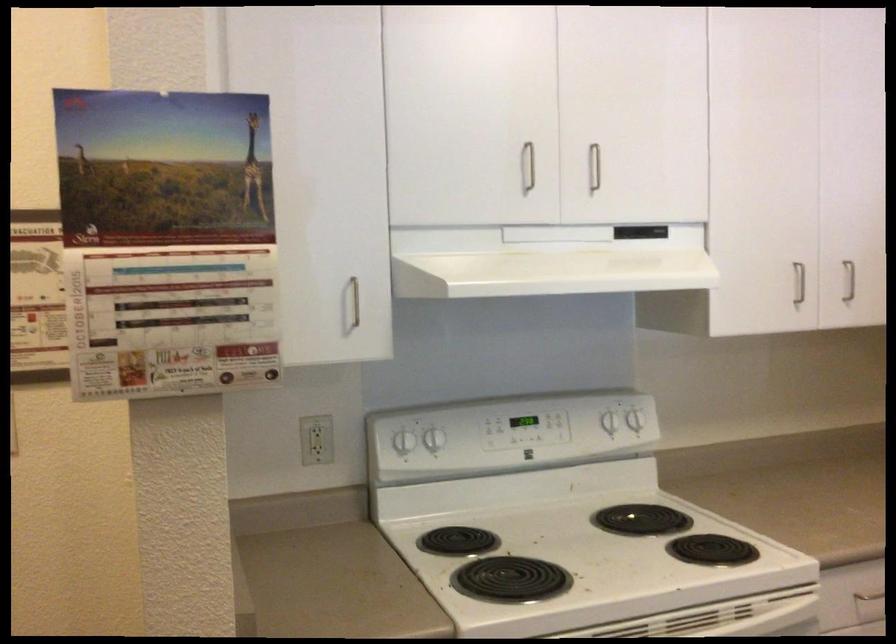
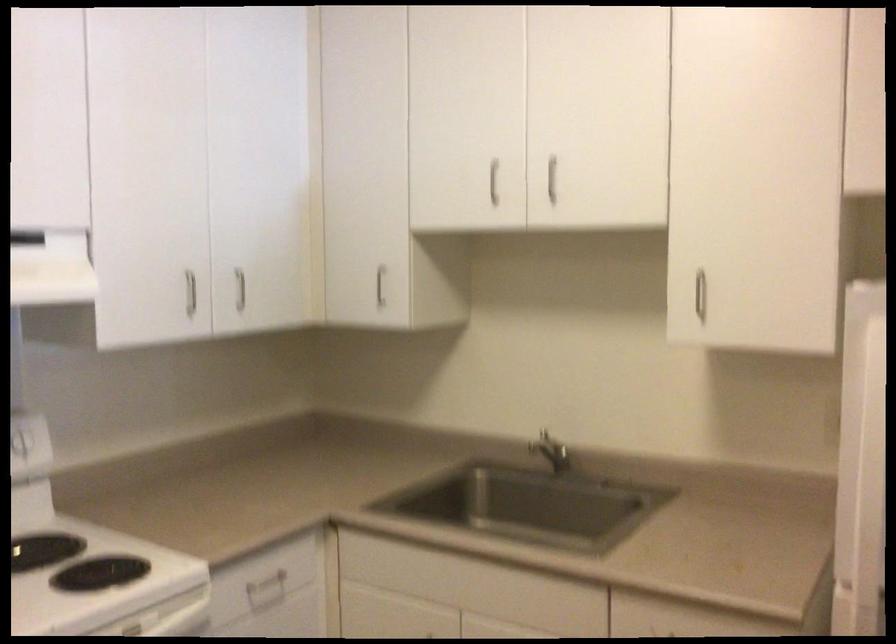
Question: The camera is either moving clockwise (left) or counter-clockwise (right) around the object. The first image is from the beginning of the video and the second image is from the end. Is the camera moving left or right when shooting the video?

Choices:
 (A) Left
 (B) Right

Answer: (A)